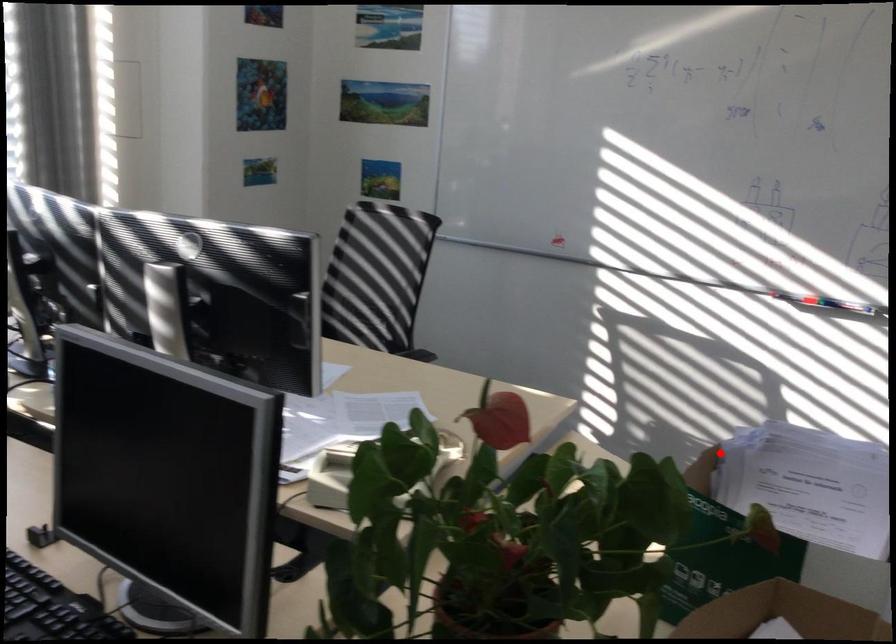
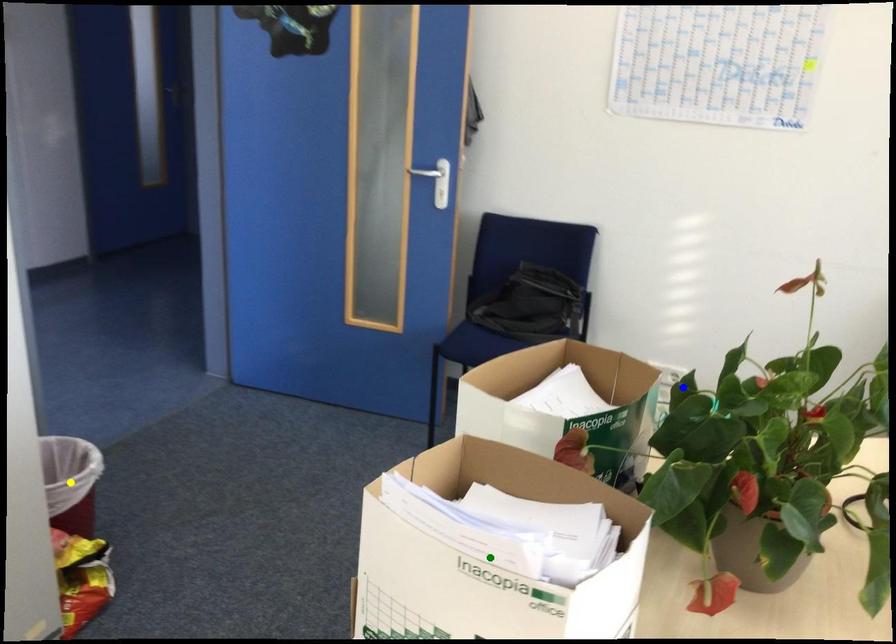
Question: I am providing you with two images of the same scene from different viewpoints. A red point is marked on the first image. You are given multiple points on the second image. Which spot in image 2 lines up with the point in image 1?

Choices:
 (A) green point
 (B) blue point
 (C) yellow point

Answer: (A)